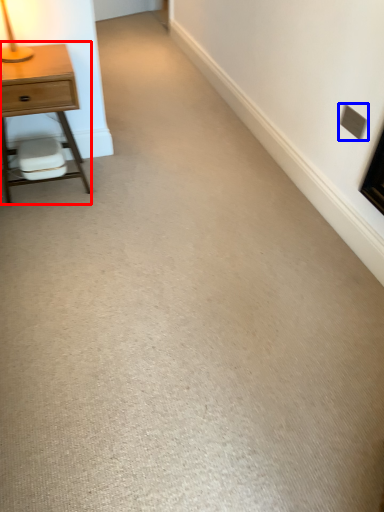
Question: Which object appears closest to the camera in this image, nightstand (highlighted by a red box) or electric outlet (highlighted by a blue box)?

Choices:
 (A) nightstand
 (B) electric outlet

Answer: (A)